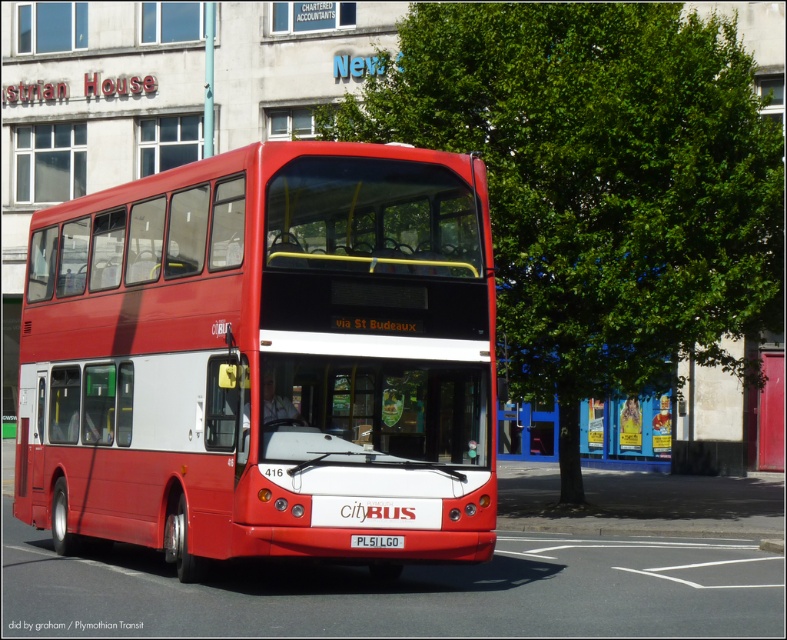
You are a delivery person trying to load a package onto a cart that can only fit items narrower than the white plastic license plate at center. You have a box that is the same width as the blue painted metal bus stop at center. Will the box fit on the cart?

The blue painted metal bus stop at center is wider than the white plastic license plate at center. Since the box matches the bus stop width, it will not fit on the cart designed for narrower items.

You are a delivery driver who needs to park your van, which is 6 meters long, between the shiny red bus at center and the blue painted metal bus stop at center. Can your van fit in the space between them?

The shiny red bus at center is 15.40 meters away from the blue painted metal bus stop at center, so yes, the van can fit in the space between them since the distance is greater than the van length of 6 meters.